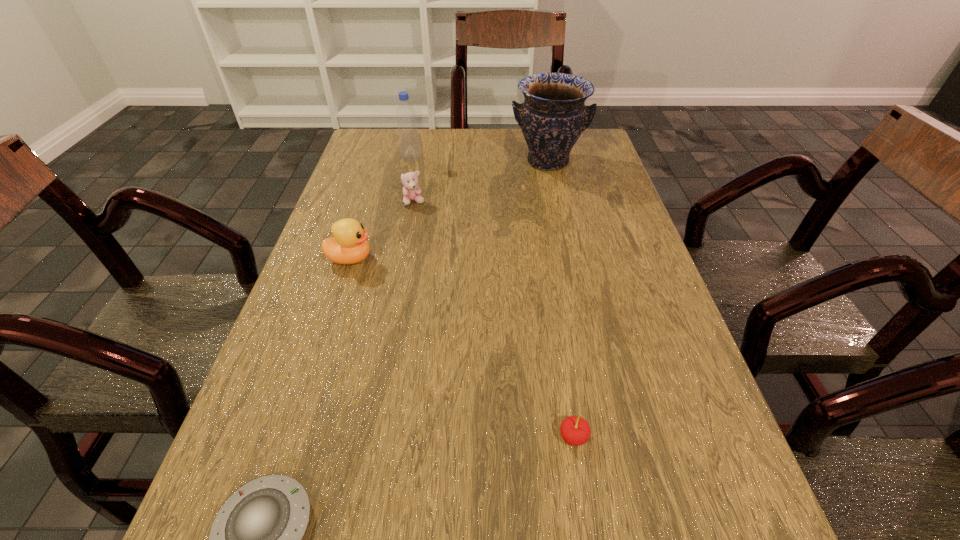
In order to click on object that is the fourth closest to the fourth farthest object in this screenshot , I will do `click(255, 539)`.

Where is `the closest object to the duckling`? This screenshot has width=960, height=540. the closest object to the duckling is located at coordinates (411, 190).

I want to click on free space that satisfies the following two spatial constraints: 1. on the face of the third tallest object; 2. on the right side of the cherry, so click(x=294, y=437).

Find the location of `free region that satisfies the following two spatial constraints: 1. on the front handle of the pottery; 2. on the face of the duckling`. free region that satisfies the following two spatial constraints: 1. on the front handle of the pottery; 2. on the face of the duckling is located at coordinates (568, 259).

Where is `free point that satisfies the following two spatial constraints: 1. at the face of the third farthest object; 2. on the right side of the cherry`? This screenshot has width=960, height=540. free point that satisfies the following two spatial constraints: 1. at the face of the third farthest object; 2. on the right side of the cherry is located at coordinates (371, 437).

You are a GUI agent. You are given a task and a screenshot of the screen. Output one action in this format:
    pyautogui.click(x=<x>, y=<y>)
    Task: Click on the free space that satisfies the following two spatial constraints: 1. at the face of the fourth nearest object; 2. on the face of the third nearest object
    
    Given the screenshot: What is the action you would take?
    pyautogui.click(x=403, y=259)

The width and height of the screenshot is (960, 540). Identify the location of free space that satisfies the following two spatial constraints: 1. at the face of the cherry; 2. on the left side of the third farthest object. (371, 437).

In order to click on vacant space that satisfies the following two spatial constraints: 1. at the face of the second nearest object; 2. on the right side of the teddy bear in this screenshot , I will do `click(371, 437)`.